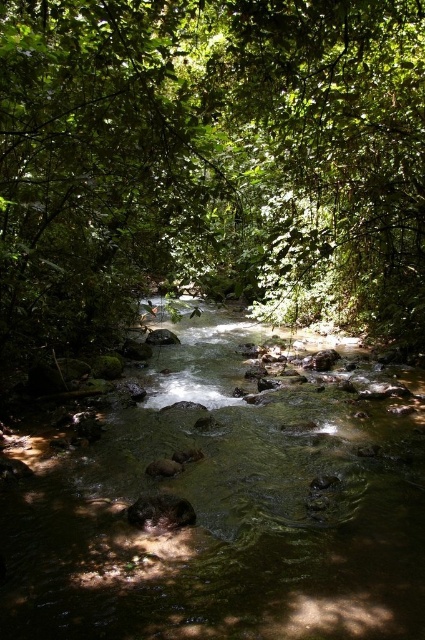
Question: Among these objects, which one is farthest from the camera?

Choices:
 (A) clear water at center
 (B) green leafy tree at center

Answer: (B)

Question: Can you confirm if green leafy tree at center is thinner than clear water at center?

Choices:
 (A) yes
 (B) no

Answer: (B)

Question: Among these objects, which one is farthest from the camera?

Choices:
 (A) clear water at center
 (B) green leafy tree at center

Answer: (B)

Question: Is green leafy tree at center wider than clear water at center?

Choices:
 (A) no
 (B) yes

Answer: (B)

Question: Is green leafy tree at center behind clear water at center?

Choices:
 (A) no
 (B) yes

Answer: (B)